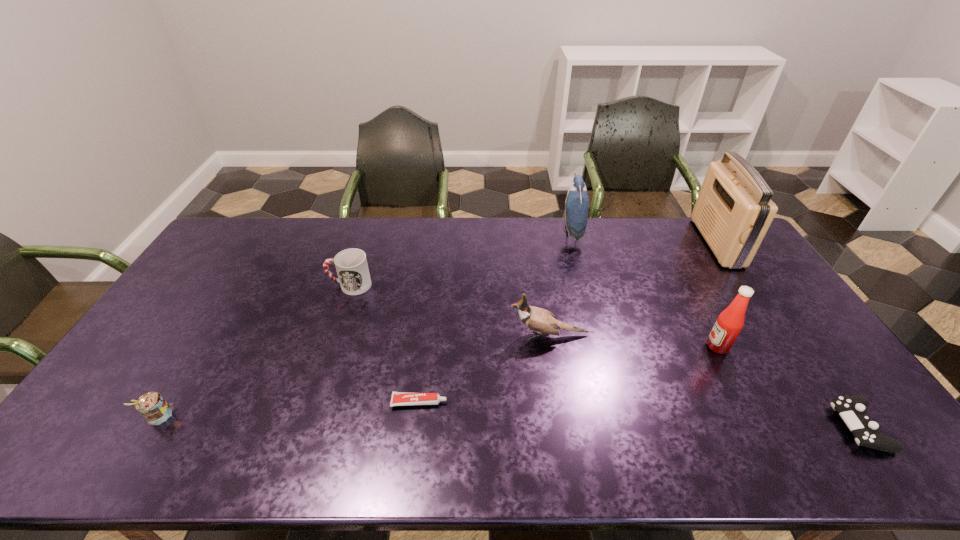
Where is `blank area located 0.230m on the front-facing side of the condiment`? The height and width of the screenshot is (540, 960). blank area located 0.230m on the front-facing side of the condiment is located at coordinates (627, 346).

This screenshot has height=540, width=960. What are the coordinates of `vacant space located 0.190m at the face of the fourth tallest object` in the screenshot? It's located at (444, 335).

The image size is (960, 540). I want to click on vacant space located at the face of the fourth tallest object, so click(x=424, y=335).

I want to click on free space located 0.220m at the face of the fourth tallest object, so click(x=435, y=335).

This screenshot has height=540, width=960. I want to click on free space located on the handle side of the fifth tallest object, so click(307, 285).

You are a GUI agent. You are given a task and a screenshot of the screen. Output one action in this format:
    pyautogui.click(x=<x>, y=<y>)
    Task: Click on the vacant space situated on the handle side of the fifth tallest object
    This screenshot has width=960, height=540.
    Given the screenshot: What is the action you would take?
    pyautogui.click(x=253, y=285)

Identify the location of free space located on the handle side of the fifth tallest object. This screenshot has width=960, height=540. (211, 285).

Locate an element on the screen. Image resolution: width=960 pixels, height=540 pixels. vacant space situated 0.170m on the back of the can is located at coordinates (198, 353).

The image size is (960, 540). Identify the location of vacant region located on the surface of the second shortest object. (725, 427).

Locate an element on the screen. free spot located on the surface of the second shortest object is located at coordinates (766, 427).